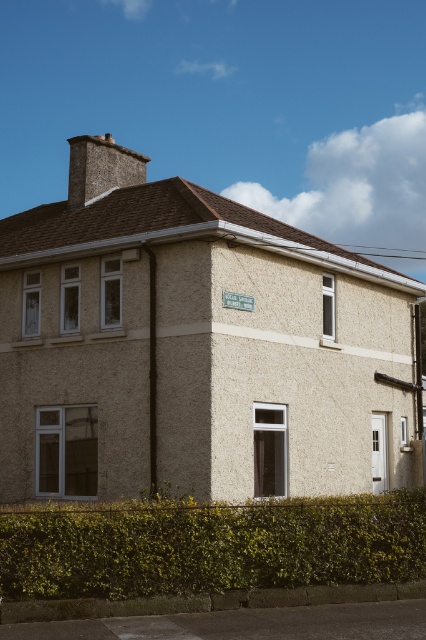
You are standing in front of the residential building and want to plant a new bush exactly where the green leafy hedge at lower center is currently located. What are the coordinates of the point where you should plant the new bush?

The coordinates for the green leafy hedge at lower center are at point (209, 545), so you should plant the new bush at those coordinates.